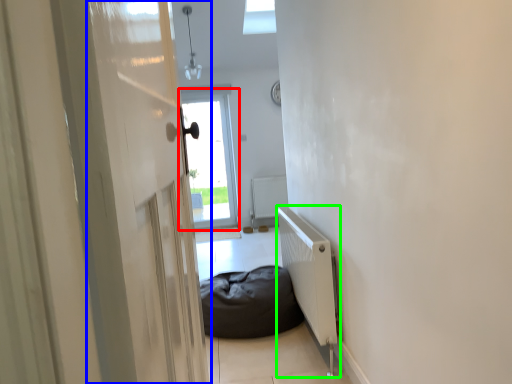
Question: Which object is the farthest from window (highlighted by a red box)? Choose among these: screen door (highlighted by a blue box) or radiator (highlighted by a green box).

Choices:
 (A) screen door
 (B) radiator

Answer: (A)